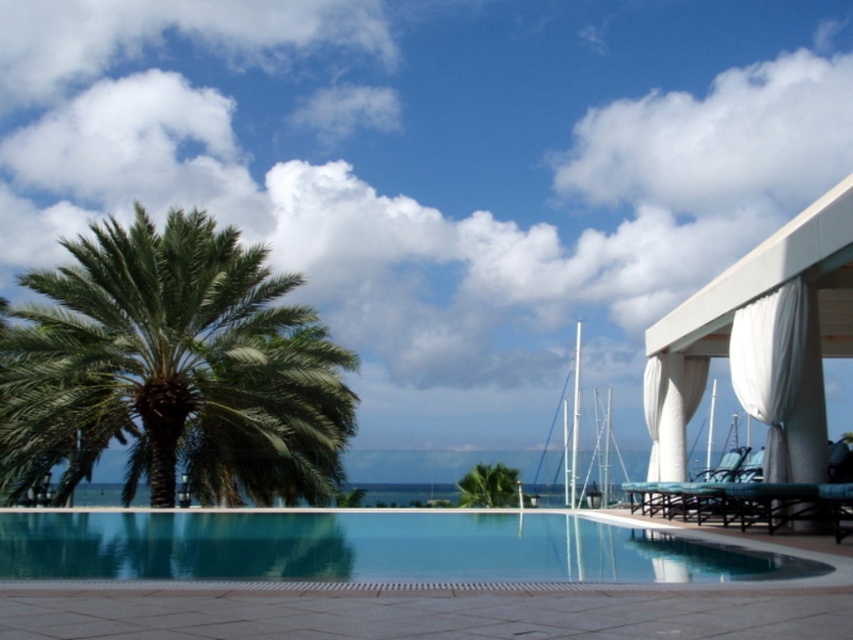
You are standing at the edge of the pool and want to walk to the point marked as point (68, 280) and then to point (421, 522). Which point will you reach first?

You will reach point (68, 280) first because it is closer to you than point (421, 522), which is further away.